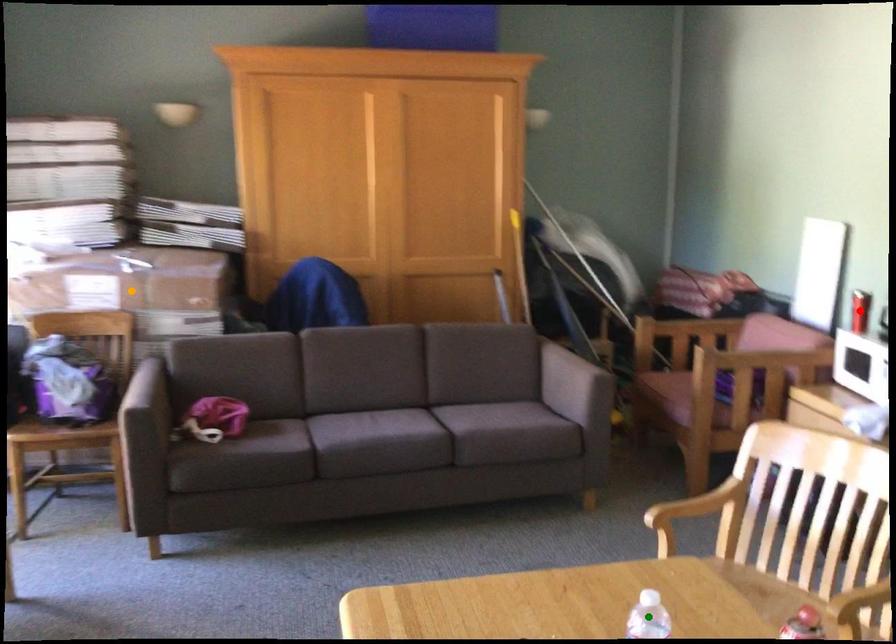
Order these from nearest to farthest:
green point, orange point, red point

orange point → red point → green point